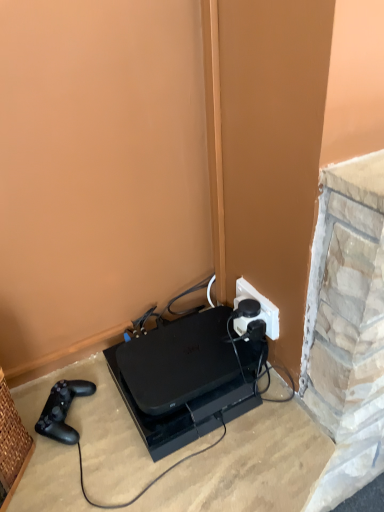
Find the location of a particular element. Image resolution: width=384 pixels, height=512 pixels. vacant space behind black matte game controller at lower left is located at coordinates (81, 373).